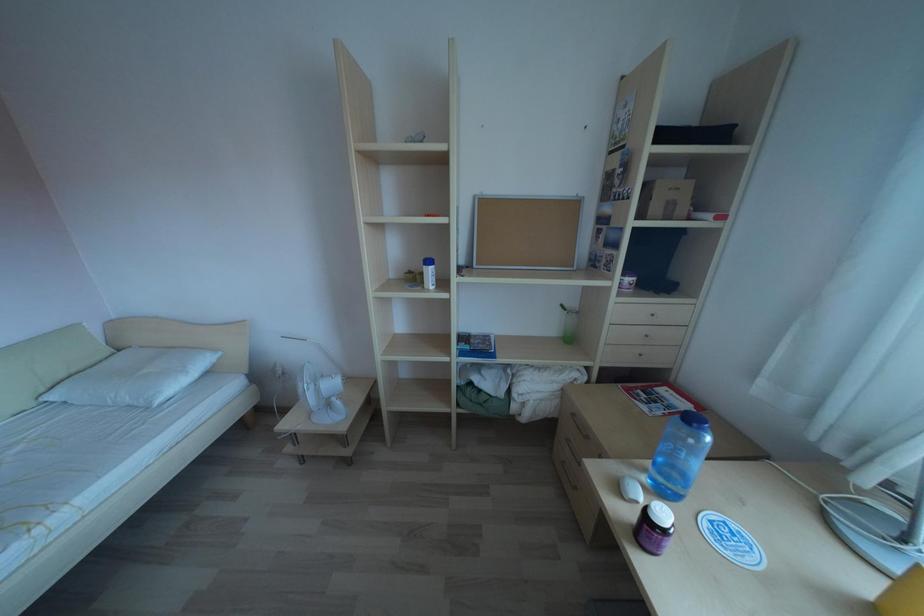
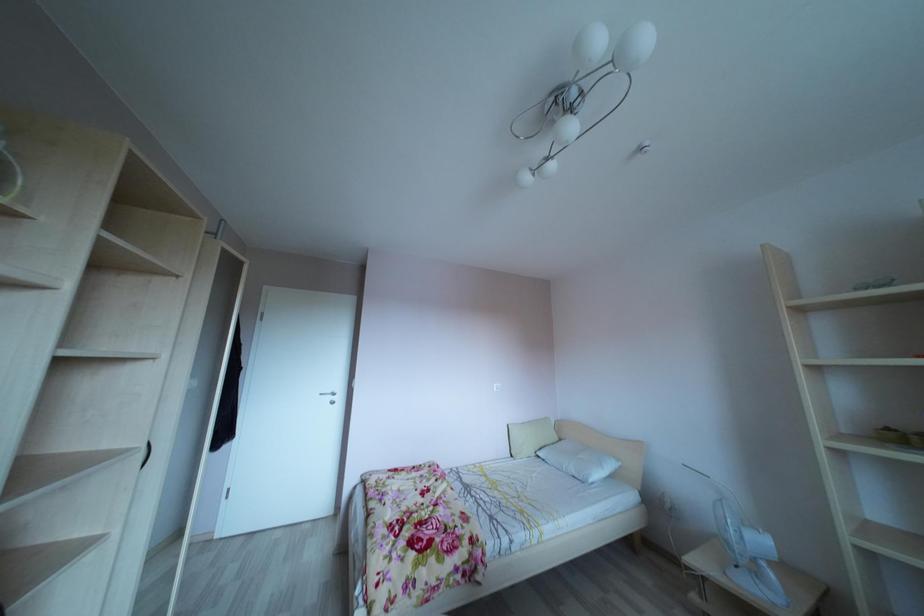
Based on the continuous images, in which direction is the camera rotating?

The camera's rotation is toward left-up.